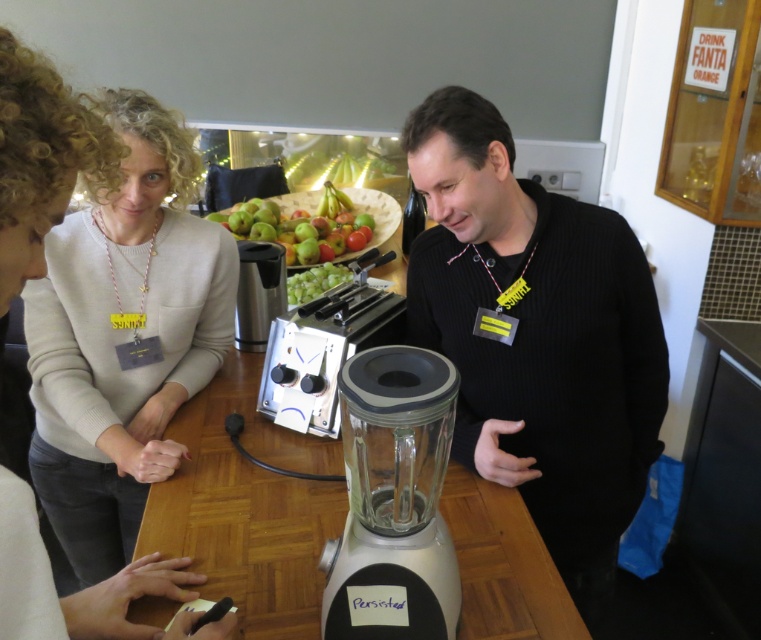
Consider the image. You are a person standing in the kitchen and want to reach the transparent glass blender at center. There is a light beige sweater at center in the way. Can you move the sweater to access the blender?

The light beige sweater at center is further to the viewer than transparent glass blender at center, meaning the sweater is closer to you. You can move the sweater to access the blender.

Consider the image. You are trying to decide which sweater to wear today. Both the black knitted sweater at center and the light beige sweater at center are on the countertop. Which one is taller?

The black knitted sweater at center is taller than the light beige sweater at center.

You are organizing a small kitchen event and need to place a decorative item on the wooden table at center. However, there is currently a light beige sweater at center on the table. Can you place the decorative item there without moving the sweater?

The light beige sweater at center is in front of the wooden table at center, meaning it is currently covering part of the table. To place the decorative item without moving the sweater, you would need to find an uncovered area of the wooden table at center that is not obstructed by the sweater.